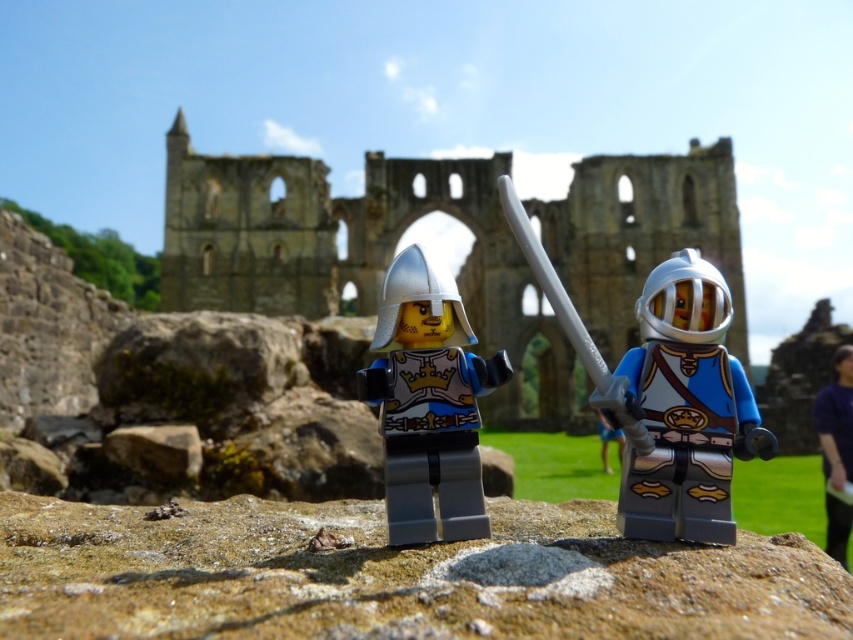
Question: Which object is the farthest from the purple fabric at lower right?

Choices:
 (A) stone ruins at center
 (B) blue fabric pants at center

Answer: (A)

Question: Is shiny silver helmet at center closer to the viewer compared to purple fabric at lower right?

Choices:
 (A) yes
 (B) no

Answer: (A)

Question: Which of the following is the closest to the observer?

Choices:
 (A) silver metallic helmet at center
 (B) purple fabric at lower right
 (C) stone ruins at center
 (D) shiny silver helmet at center

Answer: (D)

Question: Does shiny silver helmet at center have a lesser width compared to purple fabric at lower right?

Choices:
 (A) yes
 (B) no

Answer: (A)

Question: Which point appears closest to the camera in this image?

Choices:
 (A) (663, 486)
 (B) (294, 252)

Answer: (A)

Question: Is shiny silver helmet at center above silver metallic helmet at center?

Choices:
 (A) yes
 (B) no

Answer: (A)